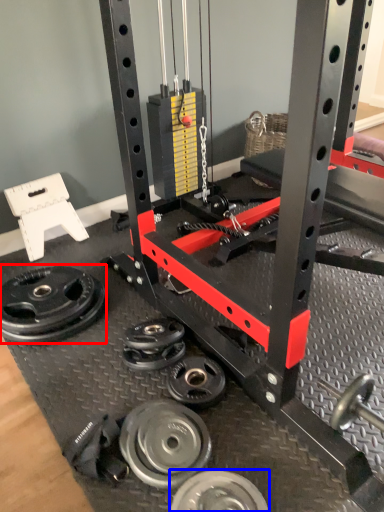
Question: Among these objects, which one is nearest to the camera, wheel (highlighted by a red box) or wheel (highlighted by a blue box)?

Choices:
 (A) wheel
 (B) wheel

Answer: (B)